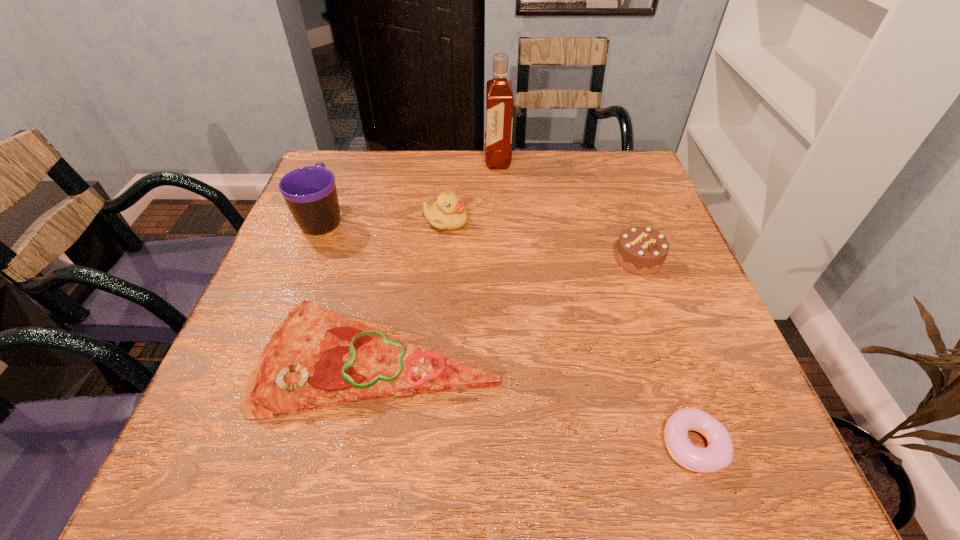
Locate an element on the screen. The height and width of the screenshot is (540, 960). liquor is located at coordinates (499, 93).

Where is `the farthest object`? The height and width of the screenshot is (540, 960). the farthest object is located at coordinates (499, 93).

Where is `mug`? The image size is (960, 540). mug is located at coordinates (310, 192).

Where is `duckling`? This screenshot has height=540, width=960. duckling is located at coordinates (448, 213).

Locate an element on the screen. The height and width of the screenshot is (540, 960). the fourth farthest object is located at coordinates (640, 250).

Where is `pizza`? This screenshot has height=540, width=960. pizza is located at coordinates coord(316,358).

Find the location of a particular element. doughnut is located at coordinates (719, 453).

Image resolution: width=960 pixels, height=540 pixels. I want to click on free spot located on the front label of the farthest object, so click(x=429, y=160).

Locate an element on the screen. The image size is (960, 540). vacant space situated 0.370m on the front label of the farthest object is located at coordinates (356, 160).

Identify the location of vacant space located on the front label of the farthest object. The height and width of the screenshot is (540, 960). (367, 160).